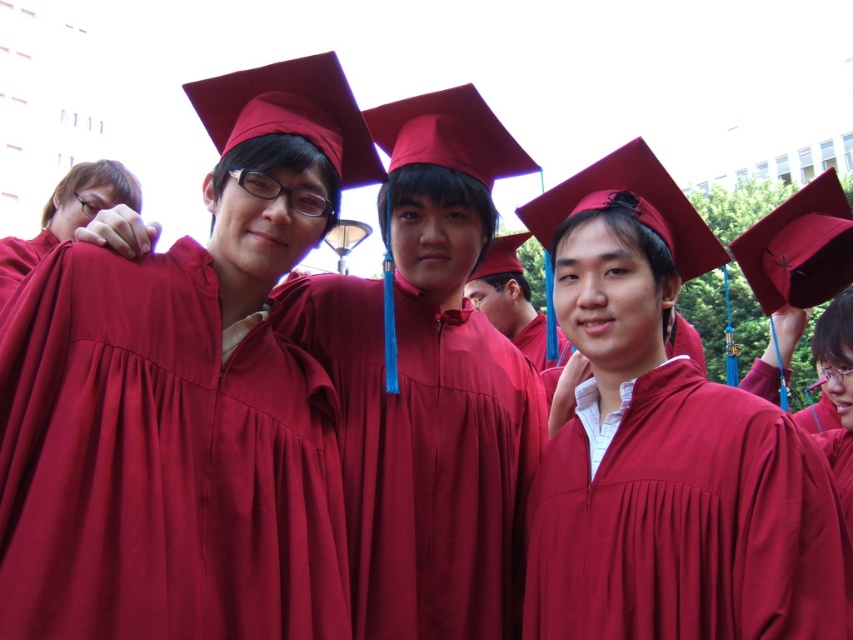
Question: Which point is closer to the camera?

Choices:
 (A) matte maroon gown at center
 (B) maroon satin gown at center
 (C) burgundy satin robe at center
 (D) matte red graduation gown at left

Answer: (C)

Question: Which of the following is the closest to the observer?

Choices:
 (A) matte red graduation gown at left
 (B) matte maroon gown at center

Answer: (B)

Question: Which object is closer to the camera taking this photo?

Choices:
 (A) matte maroon gown at center
 (B) maroon satin gown at center
 (C) matte maroon graduation gown at center
 (D) matte red graduation gown at left

Answer: (A)

Question: Can you confirm if matte maroon gown at center is smaller than maroon satin gown at center?

Choices:
 (A) yes
 (B) no

Answer: (A)

Question: Is matte maroon gown at center wider than matte red graduation gown at left?

Choices:
 (A) no
 (B) yes

Answer: (A)

Question: Is burgundy satin robe at center to the right of matte maroon graduation gown at center from the viewer's perspective?

Choices:
 (A) no
 (B) yes

Answer: (A)